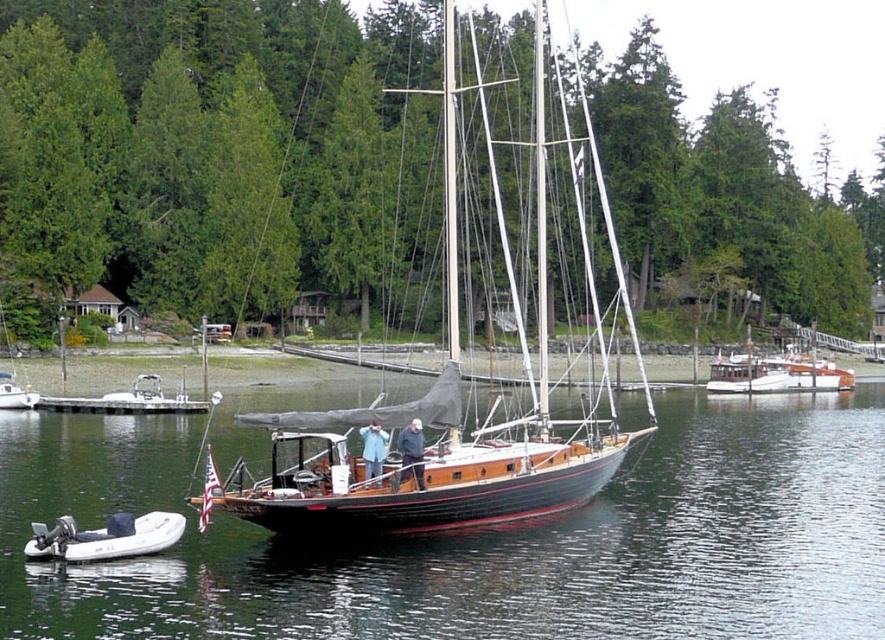
Between wooden sailboat at center and white rubber dinghy at lower left, which one has less height?

white rubber dinghy at lower left is shorter.

Does wooden sailboat at center appear under white rubber dinghy at lower left?

Actually, wooden sailboat at center is above white rubber dinghy at lower left.

The width and height of the screenshot is (885, 640). I want to click on wooden sailboat at center, so click(435, 413).

From the picture: Is wooden boat at center thinner than wooden sailboat at center?

Incorrect, wooden boat at center's width is not less than wooden sailboat at center's.

Is wooden boat at center positioned in front of wooden sailboat at center?

Yes, it is in front of wooden sailboat at center.

Who is more forward, (756,492) or (533,147)?

Point (756,492) is more forward.

Where is `wooden boat at center`? wooden boat at center is located at coordinates (482, 540).

Is point (360, 138) closer to viewer compared to point (96, 532)?

No, (360, 138) is behind (96, 532).

Is green matte tree at center above white rubber dinghy at lower left?

Indeed, green matte tree at center is positioned over white rubber dinghy at lower left.

Identify the location of green matte tree at center. (225, 154).